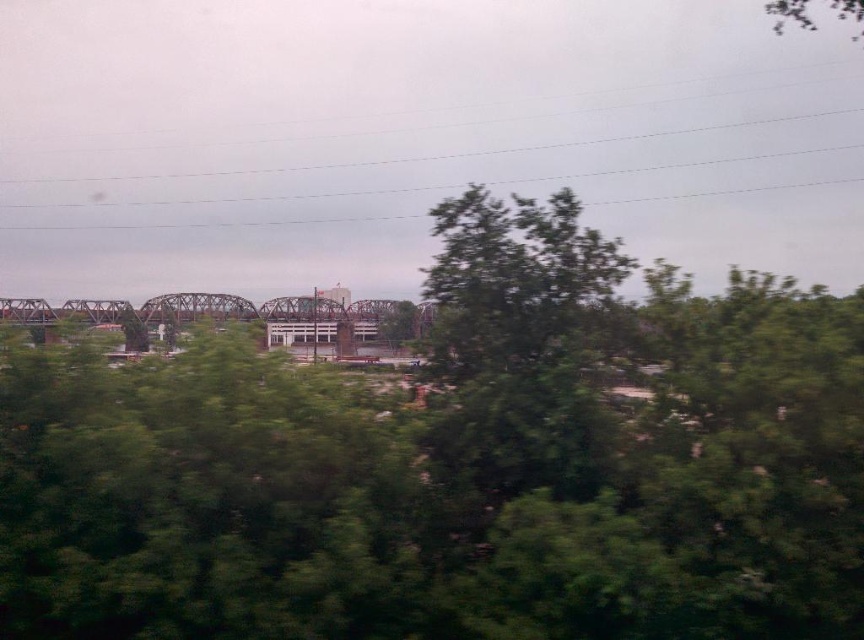
Based on the photo, who is more distant from viewer, (148, 330) or (848, 8)?

The point (848, 8) is more distant.

I want to click on metallic gray bridge at center, so click(221, 320).

Does green leafy tree at center come behind green leafy tree at upper center?

No, it is in front of green leafy tree at upper center.

Who is more forward, (x=321, y=442) or (x=780, y=20)?

Point (x=321, y=442)

The width and height of the screenshot is (864, 640). Find the location of `green leafy tree at center`. green leafy tree at center is located at coordinates (456, 467).

Which of these two, green leafy tree at center or metallic gray bridge at center, stands taller?

green leafy tree at center is taller.

Is green leafy tree at center in front of metallic gray bridge at center?

Yes, it is in front of metallic gray bridge at center.

Identify the location of green leafy tree at center. The height and width of the screenshot is (640, 864). (x=456, y=467).

Where is `green leafy tree at center`? This screenshot has height=640, width=864. green leafy tree at center is located at coordinates (456, 467).